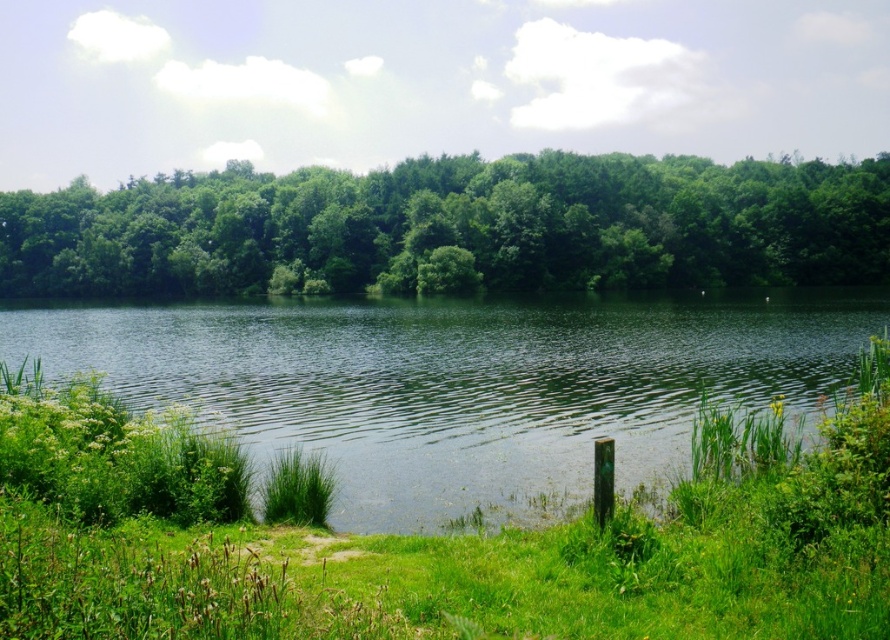
Question: Which of the following is the closest to the observer?

Choices:
 (A) green liquid water at center
 (B) green leafy trees at upper center

Answer: (A)

Question: Does green liquid water at center appear under green leafy trees at upper center?

Choices:
 (A) no
 (B) yes

Answer: (B)

Question: Among these objects, which one is farthest from the camera?

Choices:
 (A) green leafy trees at upper center
 (B) green liquid water at center

Answer: (A)

Question: Which object is farther from the camera taking this photo?

Choices:
 (A) green liquid water at center
 (B) green leafy trees at upper center

Answer: (B)

Question: Does green liquid water at center have a lesser width compared to green leafy trees at upper center?

Choices:
 (A) yes
 (B) no

Answer: (A)

Question: Is green liquid water at center above green leafy trees at upper center?

Choices:
 (A) no
 (B) yes

Answer: (A)